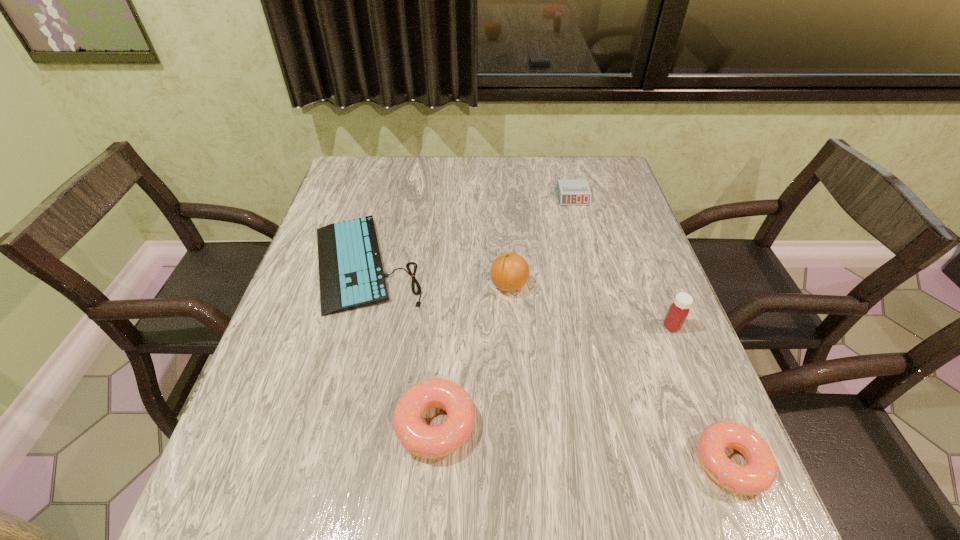
I want to click on vacant space located on the back of the right doughnut, so click(704, 395).

The height and width of the screenshot is (540, 960). Find the location of `free space located on the front of the second shortest object`. free space located on the front of the second shortest object is located at coordinates (602, 308).

I want to click on vacant region located on the back of the fourth farthest object, so click(650, 270).

This screenshot has height=540, width=960. I want to click on vacant position located 0.200m on the right of the third object from left to right, so click(610, 286).

Identify the location of vacant space located on the back of the computer keyboard. The height and width of the screenshot is (540, 960). (383, 196).

Identify the location of object positioned at the far edge. (570, 192).

At what (x,y) coordinates should I click in order to perform the action: click on object that is at the left edge. Please return your answer as a coordinate pair (x, y). Looking at the image, I should click on (351, 275).

Image resolution: width=960 pixels, height=540 pixels. I want to click on doughnut located at the right edge, so click(x=760, y=472).

Find the location of a particular element. alarm clock that is at the right edge is located at coordinates (570, 192).

In order to click on medicine present at the right edge in this screenshot , I will do `click(678, 311)`.